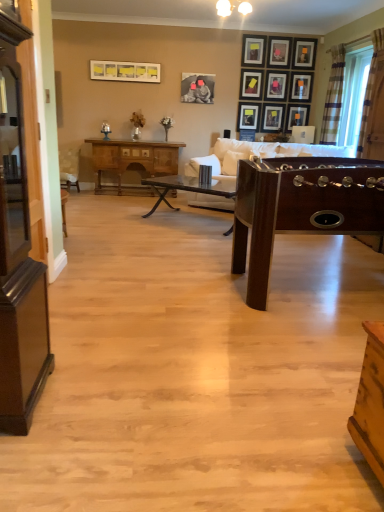
Question: Is mahogany wood foosball table at right, positioned as the 1th table in front-to-back order, to the left of matte black picture frame at upper center, positioned as the fourth picture frame in left-to-right order, from the viewer's perspective?

Choices:
 (A) yes
 (B) no

Answer: (B)

Question: Can you confirm if mahogany wood foosball table at right, which is the 3th table in back-to-front order, is positioned to the right of matte black picture frame at upper center, positioned as the fourth picture frame in left-to-right order?

Choices:
 (A) yes
 (B) no

Answer: (A)

Question: Can you see mahogany wood foosball table at right, which is the 3th table in back-to-front order, touching matte black picture frame at upper center, positioned as the fourth picture frame in left-to-right order?

Choices:
 (A) yes
 (B) no

Answer: (B)

Question: From the image's perspective, does mahogany wood foosball table at right, positioned as the 1th table in front-to-back order, appear higher than matte black picture frame at upper center, positioned as the fourth picture frame in left-to-right order?

Choices:
 (A) no
 (B) yes

Answer: (A)

Question: Does mahogany wood foosball table at right, which is the 3th table in back-to-front order, have a larger size compared to matte black picture frame at upper center, positioned as the fourth picture frame in left-to-right order?

Choices:
 (A) yes
 (B) no

Answer: (A)

Question: Can you confirm if mahogany wood foosball table at right, which is the 3th table in back-to-front order, is thinner than matte black picture frame at upper center, placed as the eighth picture frame when sorted from right to left?

Choices:
 (A) no
 (B) yes

Answer: (A)

Question: From the image's perspective, is plaid fabric curtain at upper right, which appears as the second curtain when viewed from the front, located beneath matte black picture frame at upper right, the first picture frame from the right?

Choices:
 (A) no
 (B) yes

Answer: (B)

Question: Is plaid fabric curtain at upper right, which appears as the second curtain when viewed from the front, bigger than matte black picture frame at upper right, the first picture frame from the right?

Choices:
 (A) no
 (B) yes

Answer: (B)

Question: Considering the relative sizes of plaid fabric curtain at upper right, the 1th curtain from the back, and matte black picture frame at upper right, marked as the 11th picture frame in a left-to-right arrangement, in the image provided, is plaid fabric curtain at upper right, the 1th curtain from the back, thinner than matte black picture frame at upper right, marked as the 11th picture frame in a left-to-right arrangement,?

Choices:
 (A) yes
 (B) no

Answer: (B)

Question: Is plaid fabric curtain at upper right, which appears as the second curtain when viewed from the front, shorter than matte black picture frame at upper right, the first picture frame from the right?

Choices:
 (A) yes
 (B) no

Answer: (B)

Question: Does plaid fabric curtain at upper right, the 1th curtain from the back, contain matte black picture frame at upper right, the first picture frame from the right?

Choices:
 (A) no
 (B) yes

Answer: (A)

Question: Is plaid fabric curtain at upper right, which appears as the second curtain when viewed from the front, far from matte black picture frame at upper right, marked as the 11th picture frame in a left-to-right arrangement?

Choices:
 (A) yes
 (B) no

Answer: (B)

Question: Is mahogany wood foosball table at right, which is the 3th table in back-to-front order, not within matte black picture frame at upper right, marked as the 11th picture frame in a left-to-right arrangement?

Choices:
 (A) yes
 (B) no

Answer: (A)